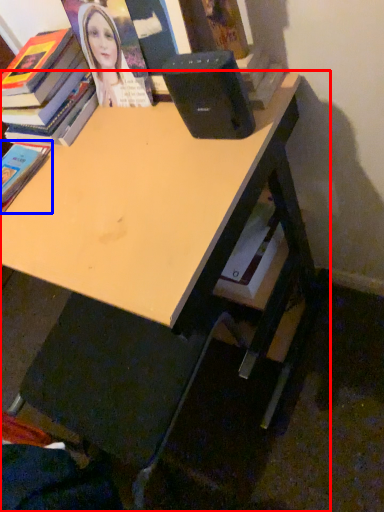
Question: Which object is closer to the camera taking this photo, desk (highlighted by a red box) or book (highlighted by a blue box)?

Choices:
 (A) desk
 (B) book

Answer: (A)